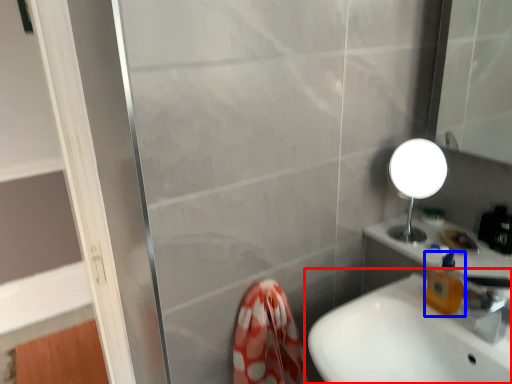
Question: Which object is further to the camera taking this photo, sink (highlighted by a red box) or soap dispenser (highlighted by a blue box)?

Choices:
 (A) sink
 (B) soap dispenser

Answer: (B)